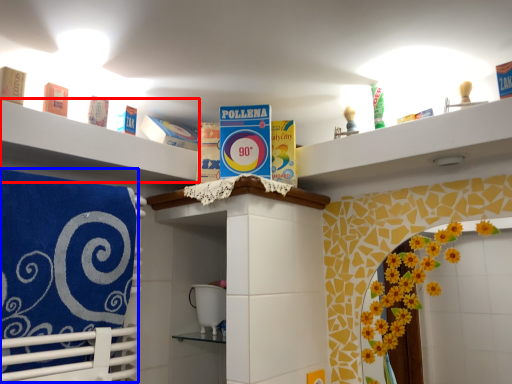
Question: Which object appears closest to the camera in this image, shelf (highlighted by a red box) or beach towel (highlighted by a blue box)?

Choices:
 (A) shelf
 (B) beach towel

Answer: (B)